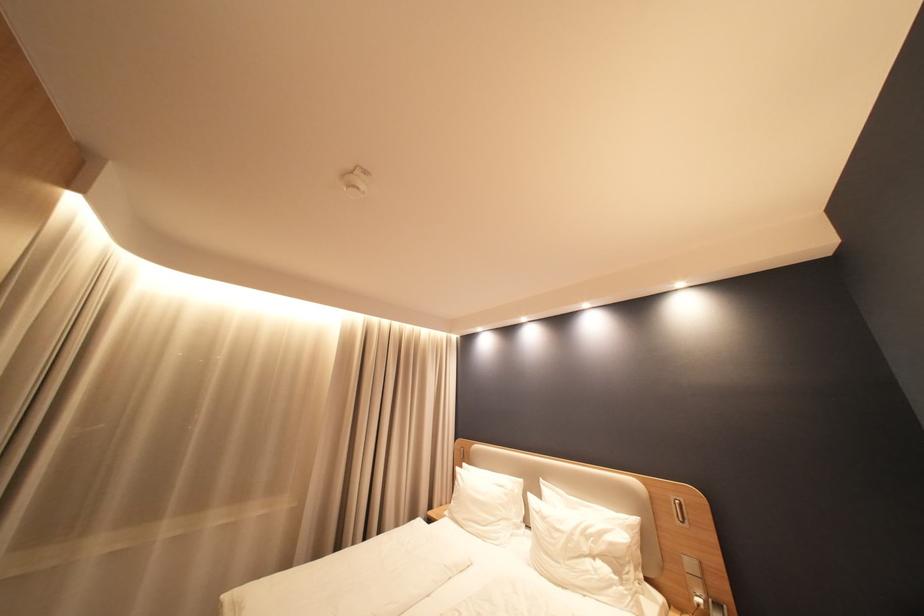
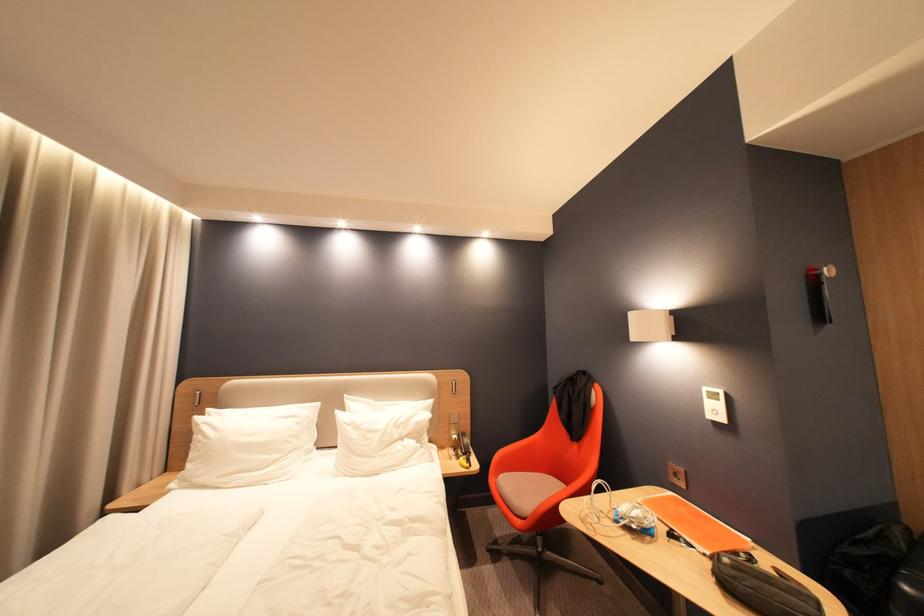
Locate, in the second image, the point that corresponds to (x=546, y=511) in the first image.

(359, 424)